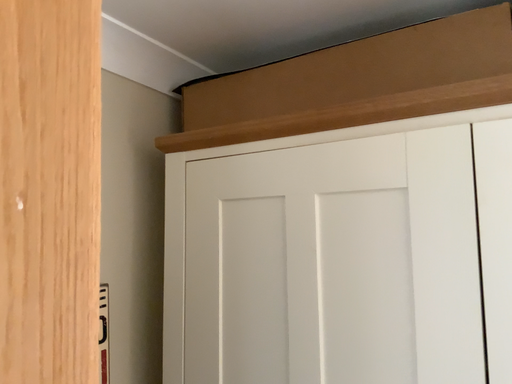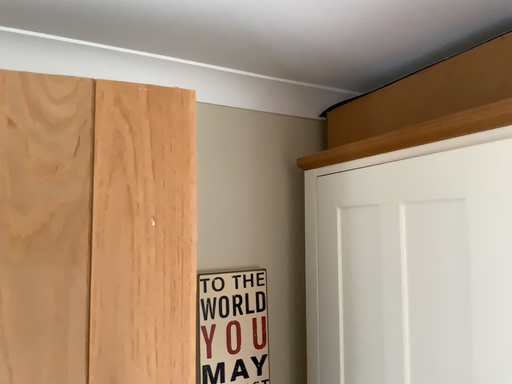
Question: How did the camera likely rotate when shooting the video?

Choices:
 (A) rotated left
 (B) rotated right

Answer: (A)